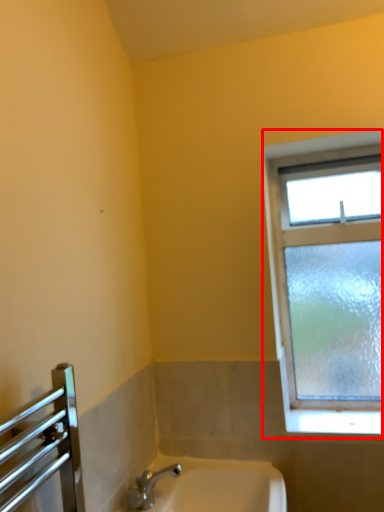
Question: Where is window (annotated by the red box) located in relation to sink in the image?

Choices:
 (A) left
 (B) right

Answer: (B)